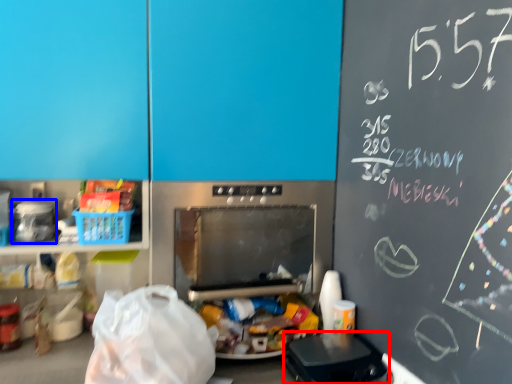
Question: Among these objects, which one is nearest to the camera, appliance (highlighted by a red box) or appliance (highlighted by a blue box)?

Choices:
 (A) appliance
 (B) appliance

Answer: (A)